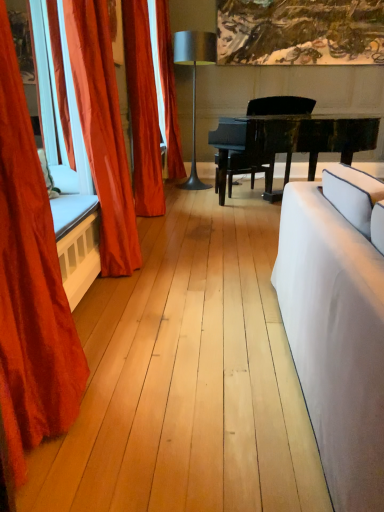
Find the location of a particular element. free point to the right of velvet red curtain at left, arranged as the 4th curtain when viewed from the back is located at coordinates (144, 420).